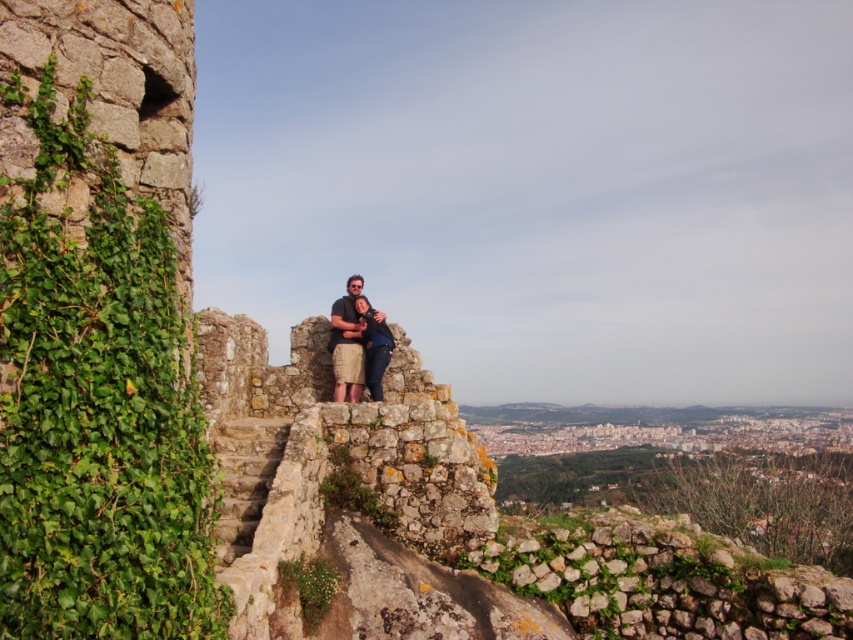
You are standing on the stone structure and want to place a small potted plant exactly at point (x=97, y=408). According to the scene description, what will happen when you try to place it there?

The point (x=97, y=408) is already occupied by green leafy ivy at left, so placing the potted plant there would displace the existing ivy.

You are standing at the top of an ancient stone structure with two points marked on the ground. The first point is at coordinates point (206, 611) and the second is at point (364, 310). If you want to move towards the point that is closer to the edge of the structure, which point should you go to?

Point (206, 611) is in front of point (364, 310), so it is closer to the edge of the structure. Therefore, you should go to point (206, 611).

You are a photographer trying to capture the scene from the same vantage point. You notice the green leafy ivy at left and the matte khaki shorts at center. Which object is closer to the bottom edge of your camera frame?

The green leafy ivy at left is positioned under the matte khaki shorts at center, so it is closer to the bottom edge of the camera frame.